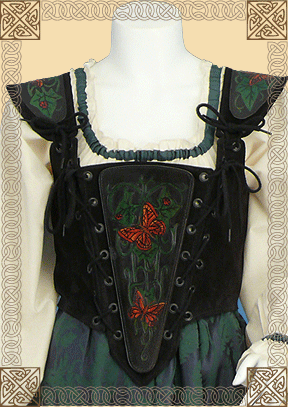
Locate an element on the screen. The width and height of the screenshot is (288, 407). empty space left of dress is located at coordinates (35, 305), (34, 208).